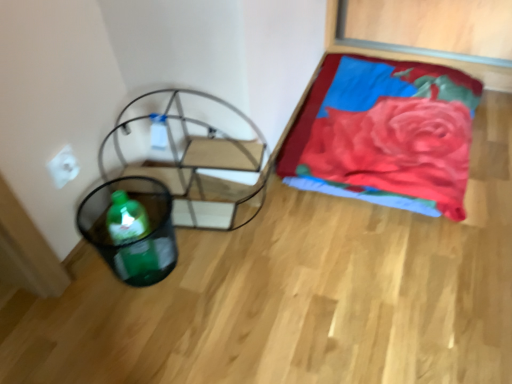
Question: Could you tell me if metallic frame swivel chair at left is facing white matte electric outlet at upper left?

Choices:
 (A) no
 (B) yes

Answer: (A)

Question: Can you see metallic frame swivel chair at left touching white matte electric outlet at upper left?

Choices:
 (A) yes
 (B) no

Answer: (B)

Question: Is metallic frame swivel chair at left to the right of white matte electric outlet at upper left from the viewer's perspective?

Choices:
 (A) no
 (B) yes

Answer: (B)

Question: Does metallic frame swivel chair at left have a greater width compared to white matte electric outlet at upper left?

Choices:
 (A) no
 (B) yes

Answer: (B)

Question: Is metallic frame swivel chair at left outside of white matte electric outlet at upper left?

Choices:
 (A) yes
 (B) no

Answer: (A)

Question: Is white matte electric outlet at upper left taller or shorter than green plastic basket at lower left?

Choices:
 (A) short
 (B) tall

Answer: (A)

Question: Would you say white matte electric outlet at upper left is to the left or to the right of green plastic basket at lower left in the picture?

Choices:
 (A) left
 (B) right

Answer: (A)

Question: Is white matte electric outlet at upper left wider or thinner than green plastic basket at lower left?

Choices:
 (A) wide
 (B) thin

Answer: (B)

Question: From the image's perspective, relative to green plastic basket at lower left, is white matte electric outlet at upper left above or below?

Choices:
 (A) above
 (B) below

Answer: (A)

Question: In the image, is metallic frame swivel chair at left on the left side or the right side of green plastic basket at lower left?

Choices:
 (A) left
 (B) right

Answer: (B)

Question: Is metallic frame swivel chair at left in front of or behind green plastic basket at lower left in the image?

Choices:
 (A) behind
 (B) front

Answer: (A)

Question: Looking at the image, does metallic frame swivel chair at left seem bigger or smaller compared to green plastic basket at lower left?

Choices:
 (A) big
 (B) small

Answer: (A)

Question: Considering the positions of metallic frame swivel chair at left and green plastic basket at lower left in the image, is metallic frame swivel chair at left wider or thinner than green plastic basket at lower left?

Choices:
 (A) wide
 (B) thin

Answer: (A)

Question: Based on their positions, is metallic frame swivel chair at left located to the left or right of velvet red blanket at upper right?

Choices:
 (A) left
 (B) right

Answer: (A)

Question: From a real-world perspective, is metallic frame swivel chair at left positioned above or below velvet red blanket at upper right?

Choices:
 (A) below
 (B) above

Answer: (B)